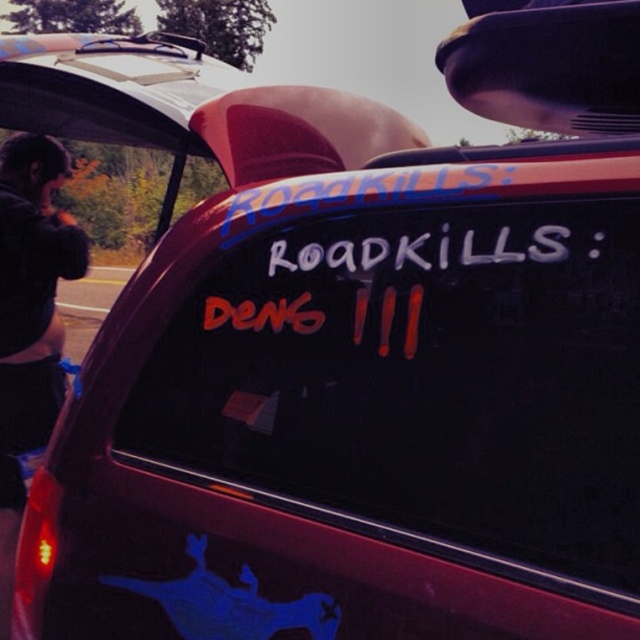
Question: Does white paint road sign at center have a larger size compared to black fabric jacket at left?

Choices:
 (A) yes
 (B) no

Answer: (B)

Question: Which object is farther from the camera taking this photo?

Choices:
 (A) black fabric jacket at left
 (B) white paint road sign at center

Answer: (A)

Question: Which object is closer to the camera taking this photo?

Choices:
 (A) black fabric jacket at left
 (B) white paint road sign at center

Answer: (B)

Question: Is white paint road sign at center bigger than black fabric jacket at left?

Choices:
 (A) yes
 (B) no

Answer: (B)

Question: Is white paint road sign at center in front of black fabric jacket at left?

Choices:
 (A) no
 (B) yes

Answer: (B)

Question: Which point is farther to the camera?

Choices:
 (A) black fabric jacket at left
 (B) white paint road sign at center

Answer: (A)